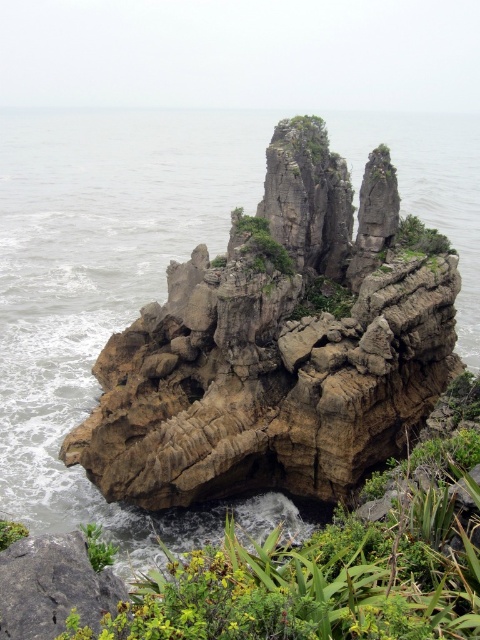
You are standing on the cliff overlooking the rough brown rock at lower left and the green leafy plant at lower left. Which object would appear larger to you?

The rough brown rock at lower left is closer to the viewer than the green leafy plant at lower left, so it would appear larger.

You are standing at the base of the coastal rock formation and want to take a photo that includes both the point at point (479,470) and the point at point (45,548). Which point should you focus on first to ensure both are in sharp focus?

You should focus on point (45,548) first because it is closer to you than point (479,470), which is further away. By focusing on the closer point, the further point will also be within the depth of field.

You are a hiker standing at the base of the rock formation and want to place a small flag at the highest point between the rough brown rock at lower left and the green leafy plant at lower left. Which object should you choose for placing the flag?

The green leafy plant at lower left is taller than the rough brown rock at lower left, so you should place the flag on the green leafy plant at lower left.